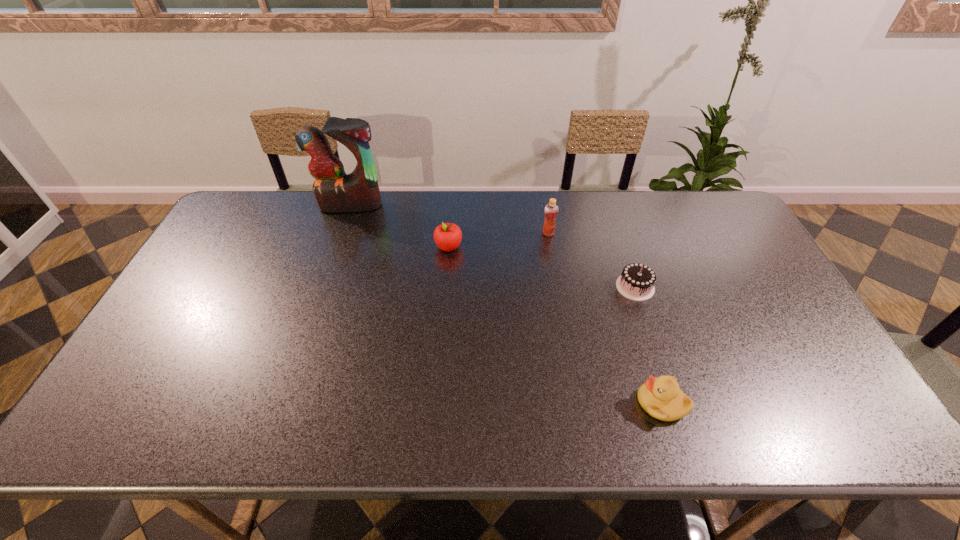
At what (x,y) coordinates should I click in order to perform the action: click on empty space between the second tallest object and the third farthest object. Please return your answer as a coordinate pair (x, y). This screenshot has height=540, width=960. Looking at the image, I should click on (498, 240).

You are a GUI agent. You are given a task and a screenshot of the screen. Output one action in this format:
    pyautogui.click(x=<x>, y=<y>)
    Task: Click on the vacant space that is in between the second nearest object and the nearest object
    
    Given the screenshot: What is the action you would take?
    pyautogui.click(x=648, y=345)

The image size is (960, 540). Find the location of `free space between the tallest object and the duckling`. free space between the tallest object and the duckling is located at coordinates (506, 304).

Locate which object ranks fourth in proximity to the second tallest object. Please provide its 2D coordinates. Your answer should be formatted as a tuple, i.e. [(x, y)], where the tuple contains the x and y coordinates of a point satisfying the conditions above.

[(335, 191)]

Point out which object is positioned as the nearest to the duckling. Please provide its 2D coordinates. Your answer should be formatted as a tuple, i.e. [(x, y)], where the tuple contains the x and y coordinates of a point satisfying the conditions above.

[(636, 282)]

Find the location of a particular element. The width and height of the screenshot is (960, 540). blank area in the image that satisfies the following two spatial constraints: 1. at the face of the orange juice; 2. on the right side of the farthest object is located at coordinates (341, 233).

The height and width of the screenshot is (540, 960). Identify the location of free location that satisfies the following two spatial constraints: 1. on the front side of the chocolate cake; 2. on the left side of the second object from left to right. (445, 287).

Where is `vacant space that satisfies the following two spatial constraints: 1. at the face of the parrot; 2. on the right side of the fourth farthest object`? vacant space that satisfies the following two spatial constraints: 1. at the face of the parrot; 2. on the right side of the fourth farthest object is located at coordinates (324, 287).